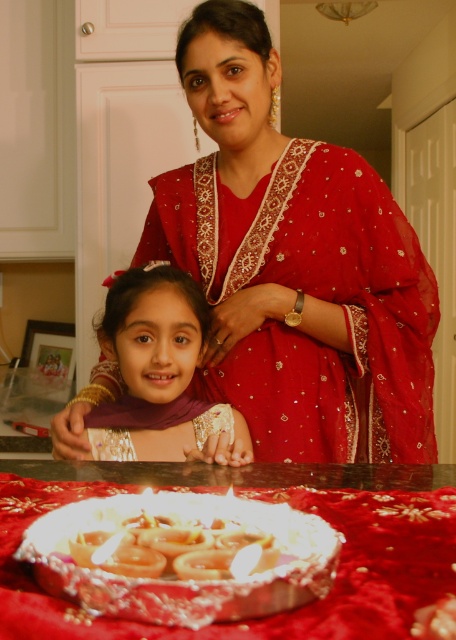
You are a chef preparing to serve a meal. You have a metallic silver tray at center where you need to place a dish. There is a point at coordinate [274,614] on the tray. Is this point on the metallic silver tray at center?

Yes, the point at coordinate [274,614] is on the metallic silver tray at center.

You are taking a photo of the two individuals in the scene. You want to focus on the point closer to the camera. Which point should you choose between point [77,627] and point [198,358]?

Point [77,627] is closer to the camera than point [198,358], so you should choose point [77,627] to focus on.

In the scene described, there is a metallic silver tray at center and a purple satin hijab at center. Which object is lower in height?

The metallic silver tray at center is lower in height compared to the purple satin hijab at center.